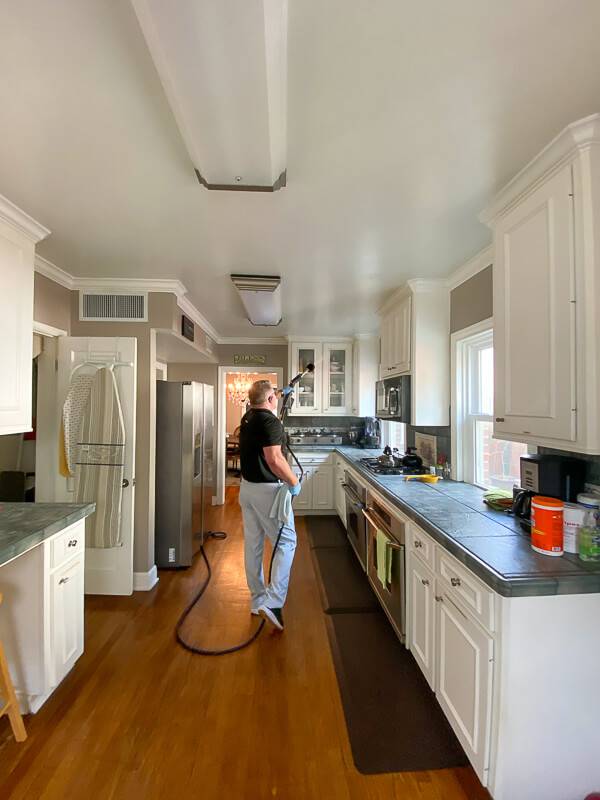
This screenshot has width=600, height=800. I want to click on hardwood floor, so click(x=255, y=686).